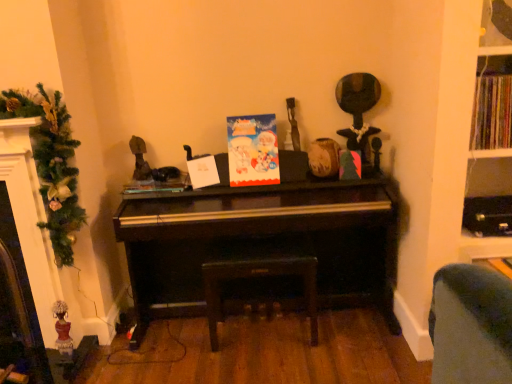
Question: Is multicolored paper book at upper right not close to leather-like dark brown stool at center?

Choices:
 (A) yes
 (B) no

Answer: (A)

Question: Does multicolored paper book at upper right have a greater height compared to leather-like dark brown stool at center?

Choices:
 (A) yes
 (B) no

Answer: (B)

Question: Considering the relative positions of multicolored paper book at upper right and leather-like dark brown stool at center in the image provided, is multicolored paper book at upper right to the left of leather-like dark brown stool at center from the viewer's perspective?

Choices:
 (A) no
 (B) yes

Answer: (A)

Question: Considering the relative positions of multicolored paper book at upper right and leather-like dark brown stool at center in the image provided, is multicolored paper book at upper right in front of leather-like dark brown stool at center?

Choices:
 (A) yes
 (B) no

Answer: (A)

Question: Does multicolored paper book at upper right lie behind leather-like dark brown stool at center?

Choices:
 (A) no
 (B) yes

Answer: (A)

Question: Is leather-like dark brown stool at center located within multicolored paper book at upper right?

Choices:
 (A) no
 (B) yes

Answer: (A)

Question: Does multicolored paper book at upper right have a greater width compared to green textured garland at left?

Choices:
 (A) no
 (B) yes

Answer: (A)

Question: Is multicolored paper book at upper right positioned with its back to green textured garland at left?

Choices:
 (A) yes
 (B) no

Answer: (B)

Question: From a real-world perspective, is multicolored paper book at upper right physically below green textured garland at left?

Choices:
 (A) no
 (B) yes

Answer: (A)

Question: Does multicolored paper book at upper right appear on the left side of green textured garland at left?

Choices:
 (A) yes
 (B) no

Answer: (B)

Question: Considering the relative sizes of multicolored paper book at upper right and green textured garland at left in the image provided, is multicolored paper book at upper right smaller than green textured garland at left?

Choices:
 (A) yes
 (B) no

Answer: (A)

Question: Is multicolored paper book at upper right positioned before green textured garland at left?

Choices:
 (A) yes
 (B) no

Answer: (B)

Question: Is shiny black piano at center at the back of green textured garland at left?

Choices:
 (A) yes
 (B) no

Answer: (B)